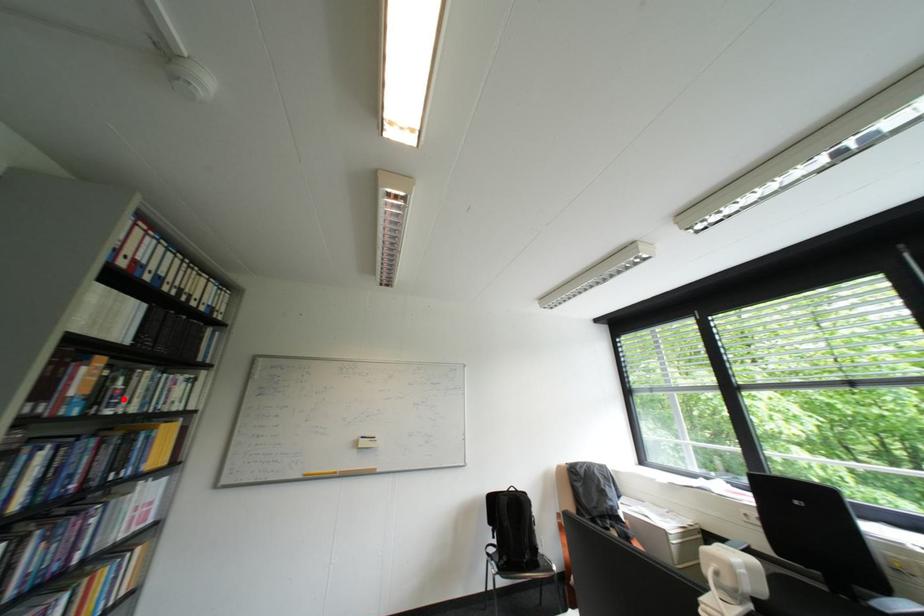
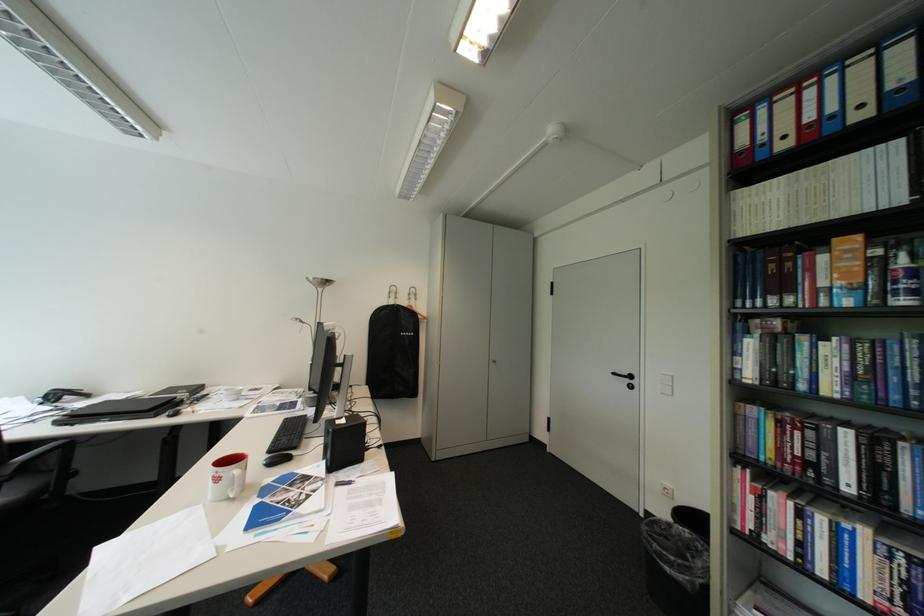
Find the pixel in the second image that matches the highlighted location in the first image.

(907, 284)